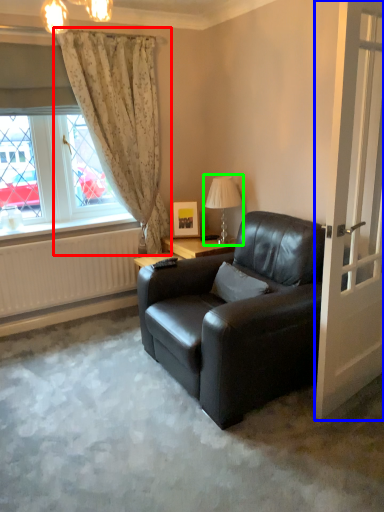
Question: Which object is the closest to the curtain (highlighted by a red box)? Choose among these: door (highlighted by a blue box) or table lamp (highlighted by a green box).

Choices:
 (A) door
 (B) table lamp

Answer: (B)